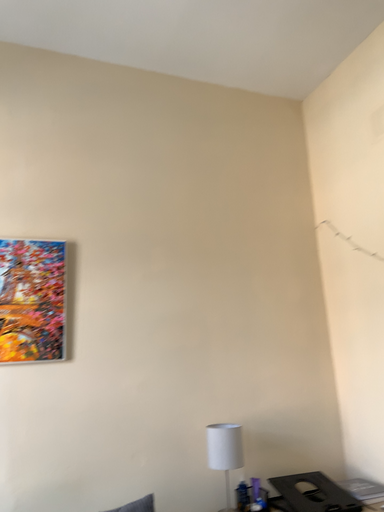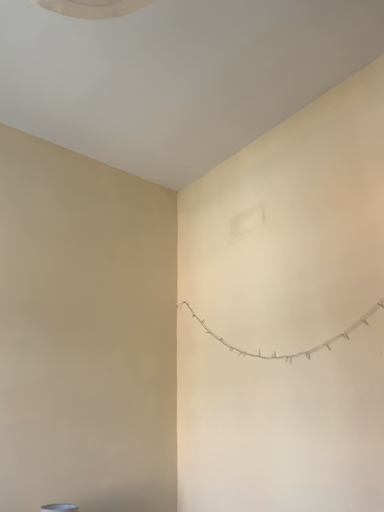
Question: Which way did the camera rotate in the video?

Choices:
 (A) rotated right
 (B) rotated left

Answer: (A)